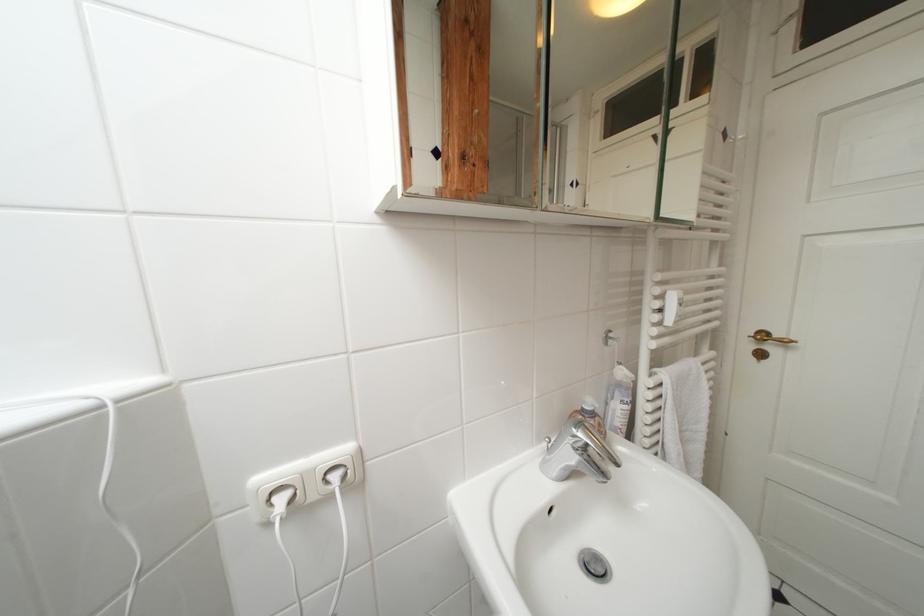
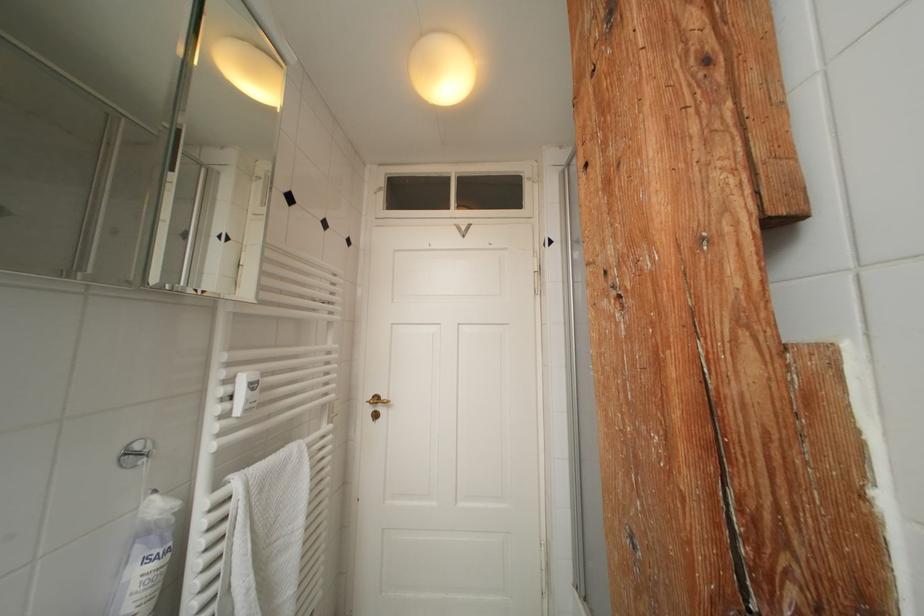
Question: The images are taken continuously from a first-person perspective. In which direction is your viewpoint rotating?

Choices:
 (A) Left
 (B) Right
 (C) Up
 (D) Down

Answer: (B)